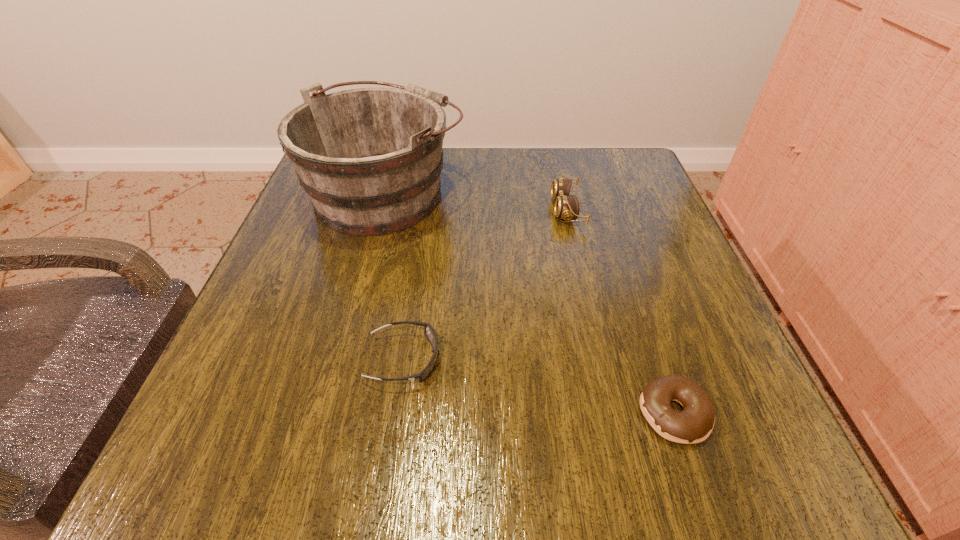
At what (x,y) coordinates should I click in order to perform the action: click on free region that satisfies the following two spatial constraints: 1. through the lenses of the doughnut; 2. on the left side of the farther goggles. Please return your answer as a coordinate pair (x, y). The height and width of the screenshot is (540, 960). Looking at the image, I should click on pos(614,413).

Locate an element on the screen. Image resolution: width=960 pixels, height=540 pixels. vacant space that satisfies the following two spatial constraints: 1. through the lenses of the third shortest object; 2. on the back side of the doughnut is located at coordinates (614, 413).

Where is `free location that satisfies the following two spatial constraints: 1. on the back side of the doughnut; 2. on the lenses of the shorter goggles`? This screenshot has width=960, height=540. free location that satisfies the following two spatial constraints: 1. on the back side of the doughnut; 2. on the lenses of the shorter goggles is located at coordinates click(656, 359).

You are a GUI agent. You are given a task and a screenshot of the screen. Output one action in this format:
    pyautogui.click(x=<x>, y=<y>)
    Task: Click on the vacant space that satisfies the following two spatial constraints: 1. on the lenses of the nearer goggles; 2. on the left side of the doughnut
    The image size is (960, 540).
    Given the screenshot: What is the action you would take?
    pyautogui.click(x=396, y=413)

Locate an element on the screen. This screenshot has height=540, width=960. free location that satisfies the following two spatial constraints: 1. on the front side of the rightmost object; 2. on the left side of the wine bucket is located at coordinates (328, 413).